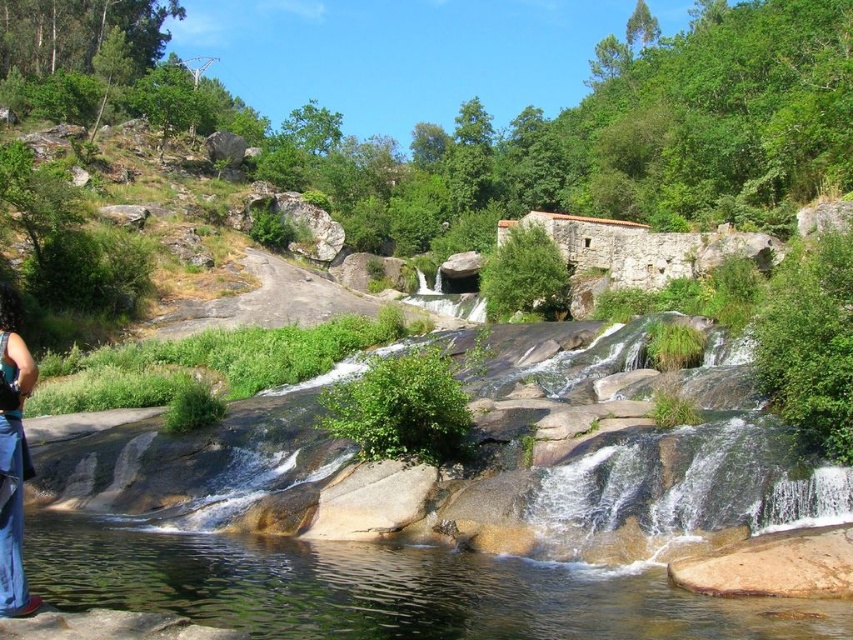
Can you confirm if clear water at lower left is positioned below blue denim dress at lower left?

Correct, clear water at lower left is located below blue denim dress at lower left.

Is clear water at lower left further to the viewer compared to blue denim dress at lower left?

Yes, clear water at lower left is further from the viewer.

Does point (804, 600) come farther from viewer compared to point (4, 454)?

Yes, it is.

The width and height of the screenshot is (853, 640). What are the coordinates of `clear water at lower left` in the screenshot? It's located at (387, 589).